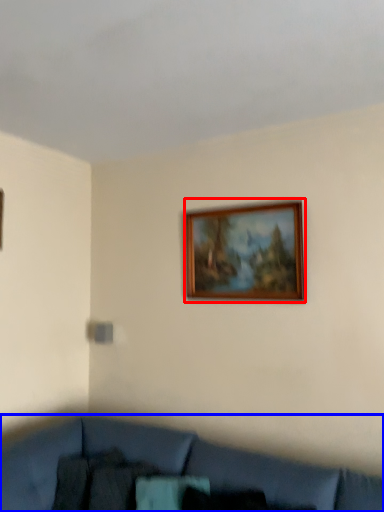
Question: Which point is closer to the camera, picture frame (highlighted by a red box) or studio couch (highlighted by a blue box)?

Choices:
 (A) picture frame
 (B) studio couch

Answer: (B)